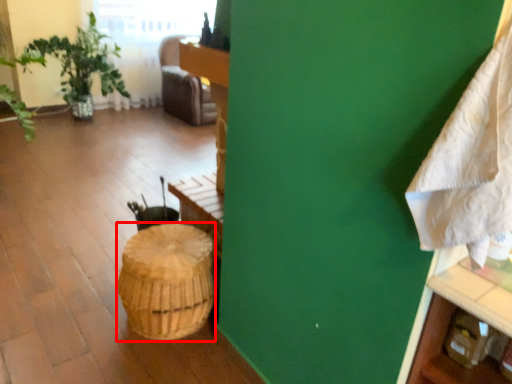
Question: Observing the image, what is the correct spatial positioning of basket (annotated by the red box) in reference to blanket?

Choices:
 (A) right
 (B) left

Answer: (B)